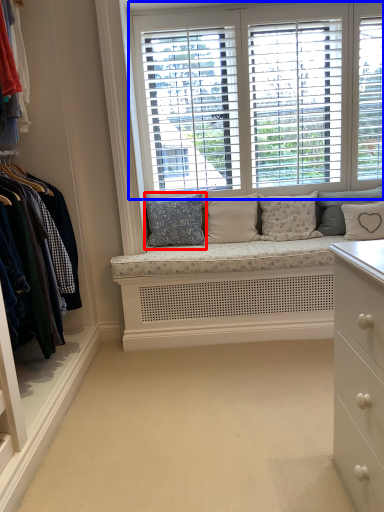
Question: Which object appears farthest to the camera in this image, pillow (highlighted by a red box) or window (highlighted by a blue box)?

Choices:
 (A) pillow
 (B) window

Answer: (A)